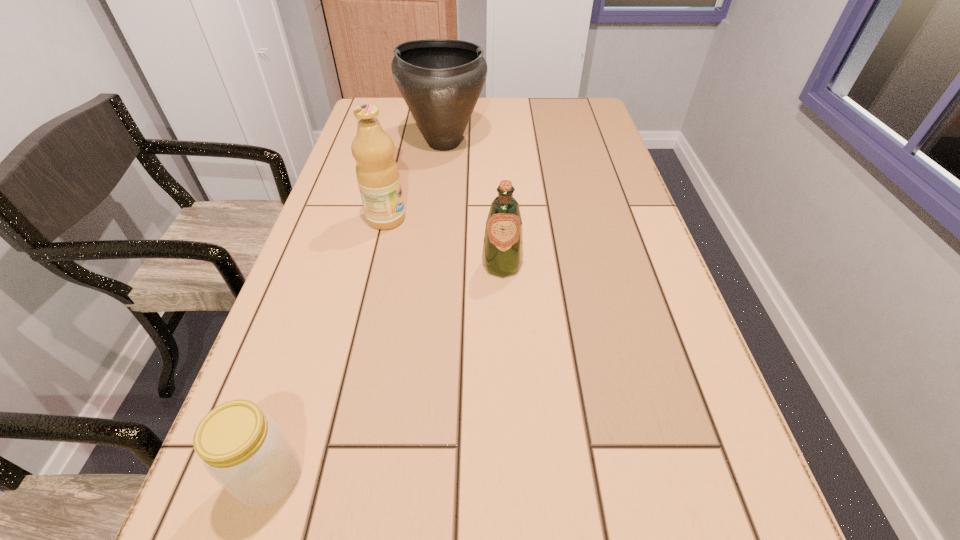
This screenshot has width=960, height=540. I want to click on object that is the third closest to the urn, so click(243, 449).

Where is `free point that satisfies the following two spatial constraints: 1. on the back side of the urn; 2. on the right side of the nearest object`? free point that satisfies the following two spatial constraints: 1. on the back side of the urn; 2. on the right side of the nearest object is located at coordinates (377, 143).